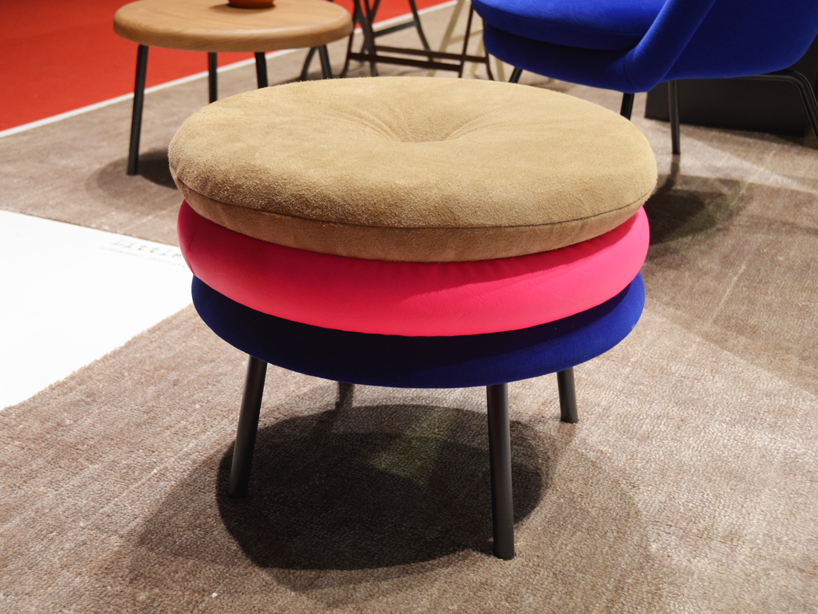
Find the location of `stool leg`. stool leg is located at coordinates (136, 126).